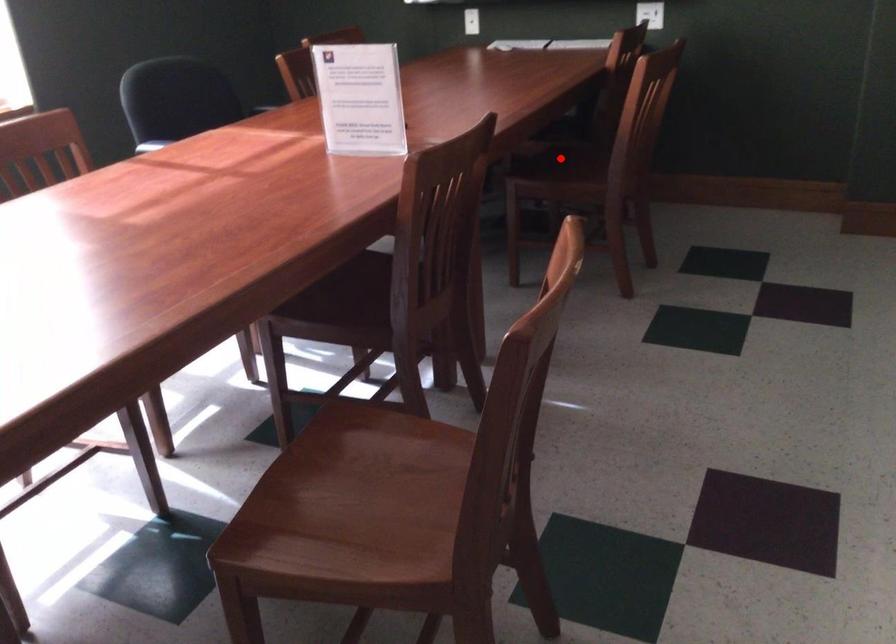
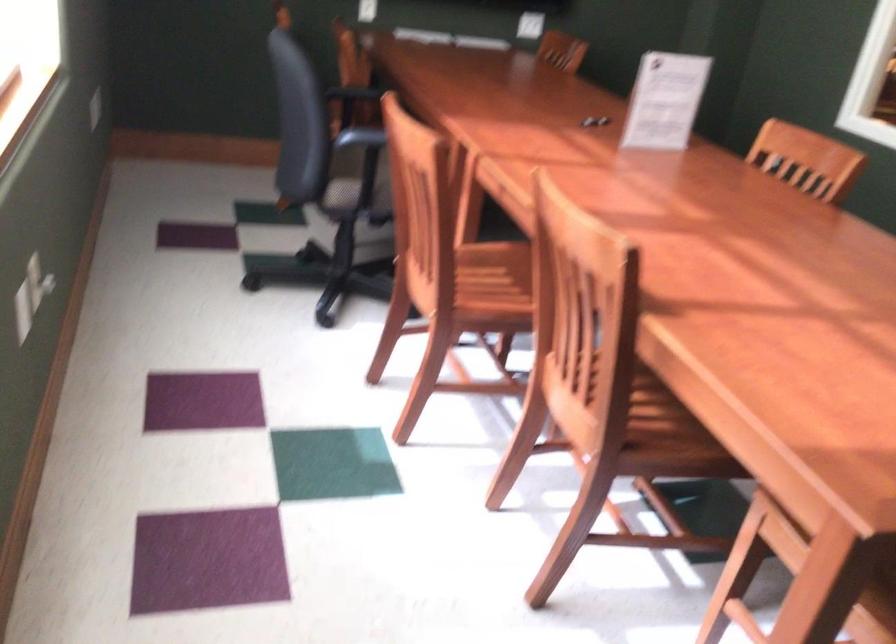
Question: I am providing you with two images of the same scene from different viewpoints. A red point is marked on the first image. At the location where the point appears in image 1, is it still visible in image 2?

Choices:
 (A) Yes
 (B) No

Answer: (B)